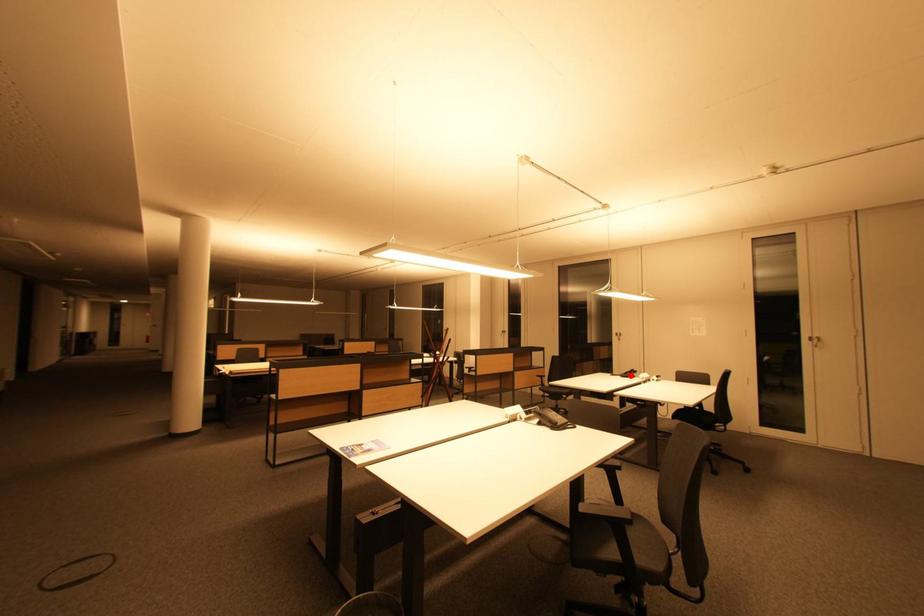
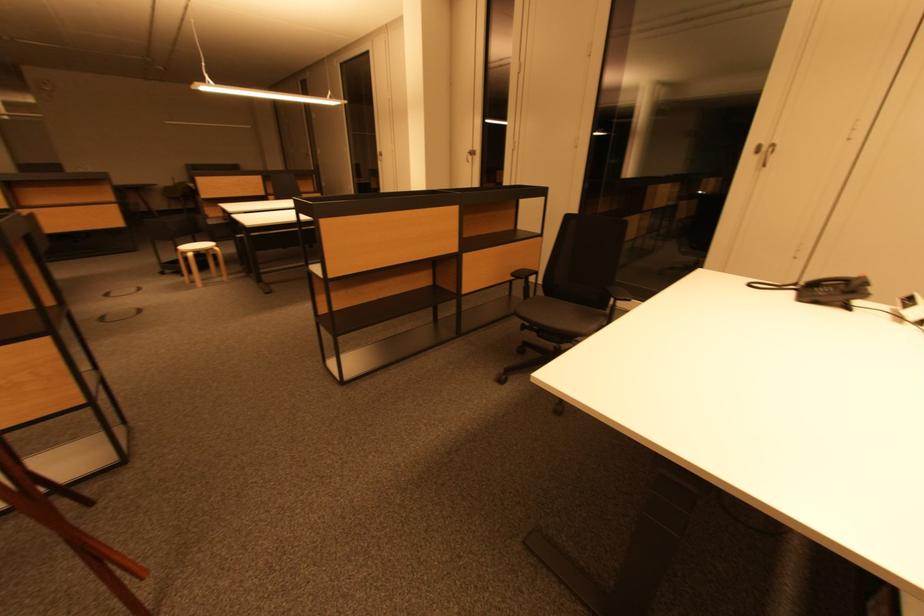
In the second image, find the point that corresponds to the highlighted location in the first image.

(819, 286)